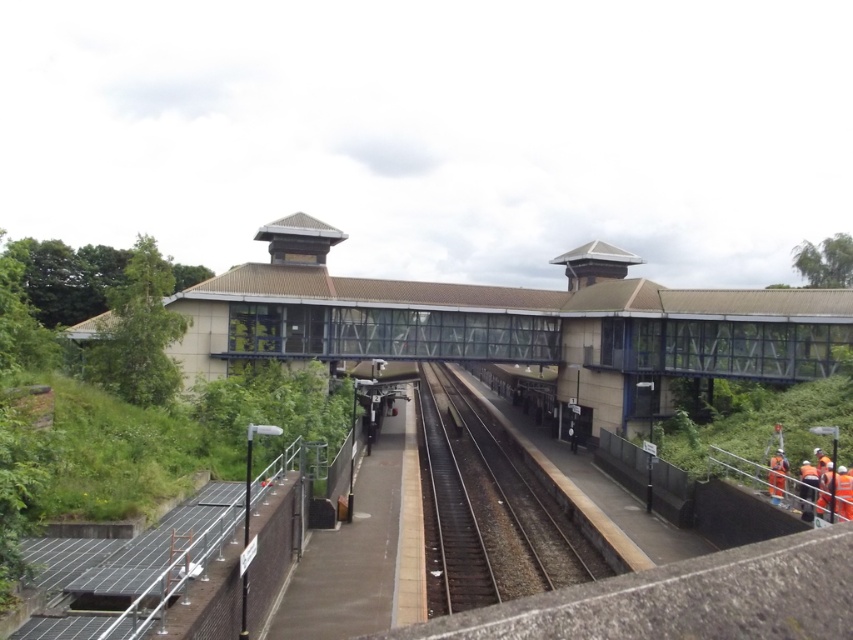
You are standing on the platform at the modern railway station and need to locate the orange reflective rail at lower right. According to the coordinates provided, where exactly is it positioned?

The orange reflective rail at lower right is positioned at point 0.758 on the x axis and 0.923 on the y axis.

You are standing on the platform of the railway station and want to determine which of the two points, point (801,516) or point (816,480), is closer to you. Based on the scene, which point is nearer?

→ Point (801,516) is closer to the viewer than point (816,480).